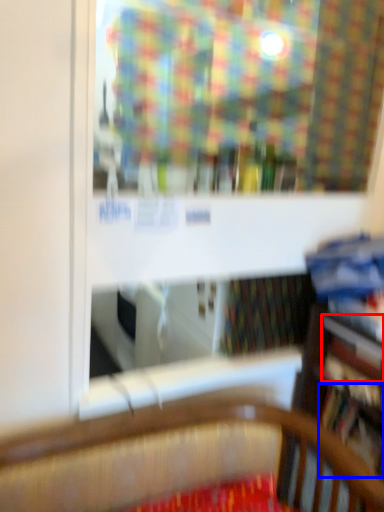
Question: Which object appears farthest to the camera in this image, book (highlighted by a red box) or book (highlighted by a blue box)?

Choices:
 (A) book
 (B) book

Answer: (B)